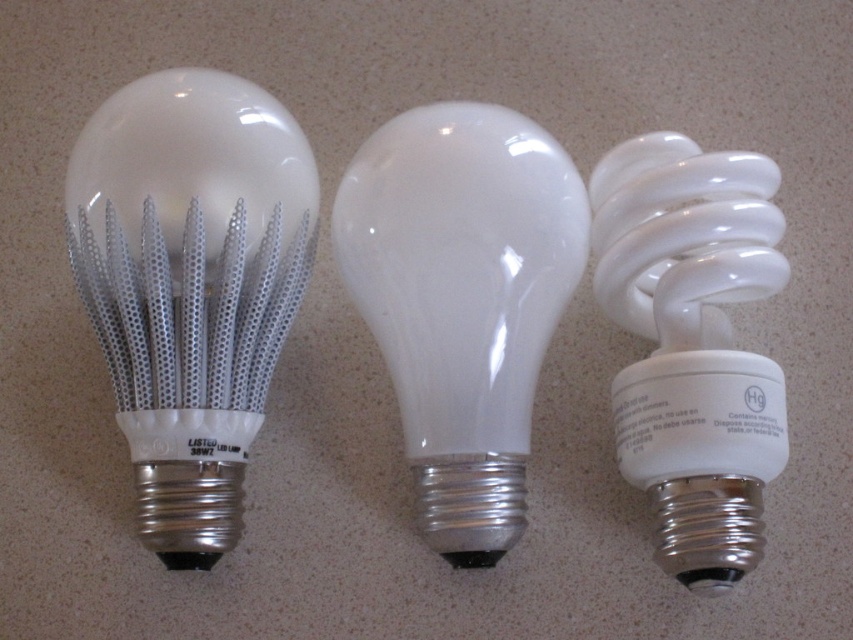
Does white metallic led bulb at left appear on the left side of matte white bulb at center?

A: Yes, white metallic led bulb at left is to the left of matte white bulb at center.

Is white metallic led bulb at left bigger than matte white bulb at center?

Correct, white metallic led bulb at left is larger in size than matte white bulb at center.

Find the location of a particular element. The height and width of the screenshot is (640, 853). white metallic led bulb at left is located at coordinates (190, 284).

Which of these two, white metallic led bulb at left or white glossy spiral bulb at right, stands shorter?

white glossy spiral bulb at right is shorter.

Is white metallic led bulb at left below white glossy spiral bulb at right?

No, white metallic led bulb at left is not below white glossy spiral bulb at right.

Who is more forward, (109, 268) or (680, 285)?

Positioned in front is point (109, 268).

Find the location of a particular element. white metallic led bulb at left is located at coordinates pyautogui.click(x=190, y=284).

Can you confirm if matte white bulb at center is positioned above white glossy spiral bulb at right?

Yes.

Between matte white bulb at center and white glossy spiral bulb at right, which one has less height?

Standing shorter between the two is white glossy spiral bulb at right.

Is point (430, 442) more distant than point (645, 148)?

No, it is not.

The image size is (853, 640). I want to click on matte white bulb at center, so click(x=462, y=300).